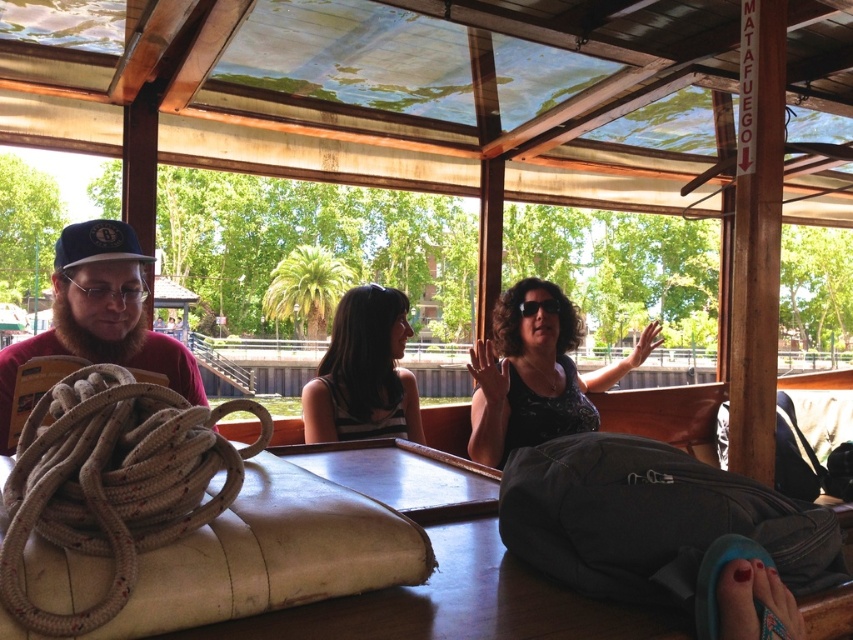
Question: Is wooden table at center below blue fabric baseball cap at left?

Choices:
 (A) no
 (B) yes

Answer: (B)

Question: Which is farther from the black textured tank top at center?

Choices:
 (A) matte red cap at left
 (B) wooden table at center
 (C) matte black shirt at center

Answer: (B)

Question: Can you confirm if matte black shirt at center is smaller than matte red cap at left?

Choices:
 (A) yes
 (B) no

Answer: (B)

Question: Which of the following is the farthest from the observer?

Choices:
 (A) (373, 381)
 (B) (103, 358)
 (C) (61, 234)

Answer: (A)

Question: Does black textured tank top at center have a smaller size compared to blue fabric baseball cap at left?

Choices:
 (A) no
 (B) yes

Answer: (A)

Question: Which of the following is the farthest from the observer?

Choices:
 (A) click(x=373, y=388)
 (B) click(x=143, y=253)

Answer: (A)